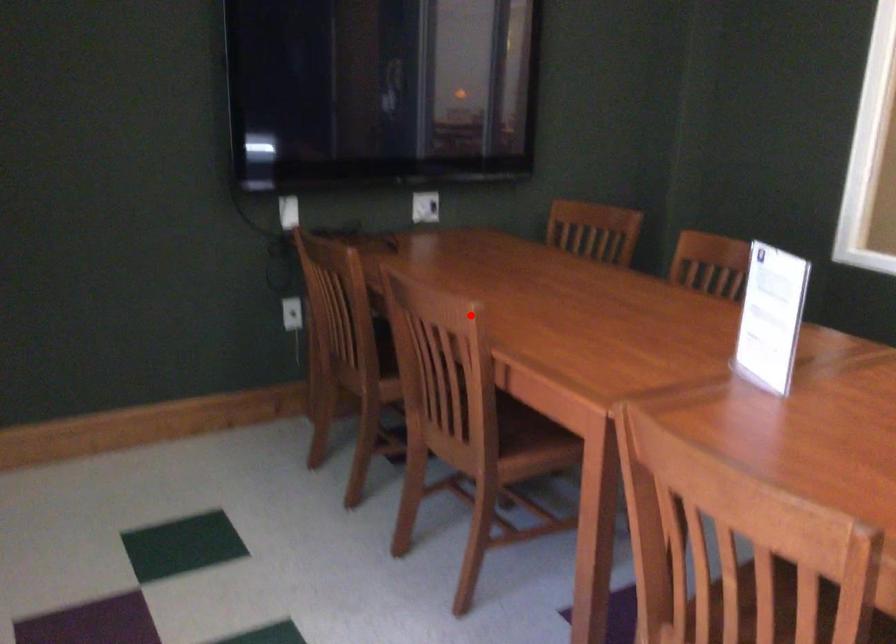
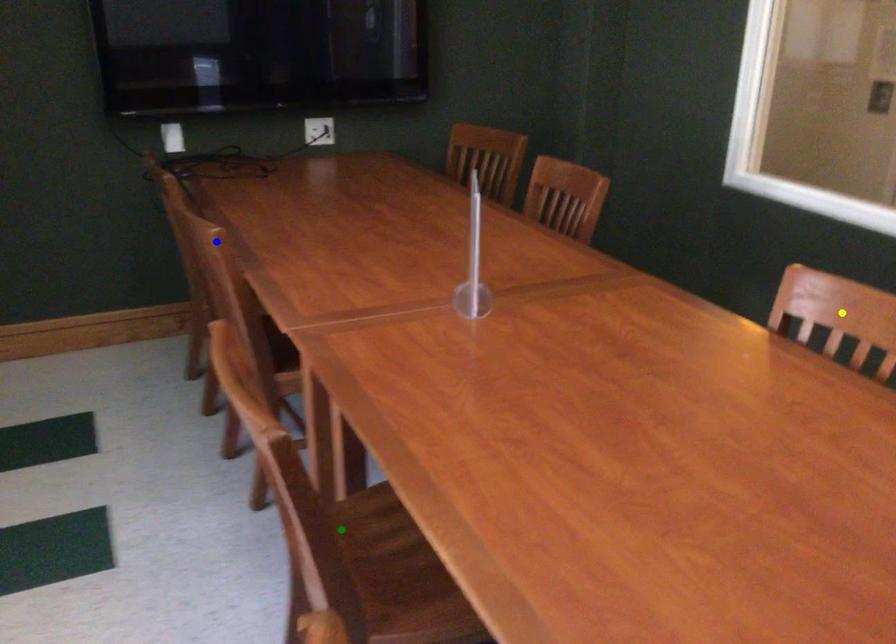
Question: I am providing you with two images of the same scene from different viewpoints. A red point is marked on the first image. You are given multiple points on the second image. Can you choose the point in image 2 that corresponds to the point in image 1?

Choices:
 (A) green point
 (B) blue point
 (C) yellow point

Answer: (B)